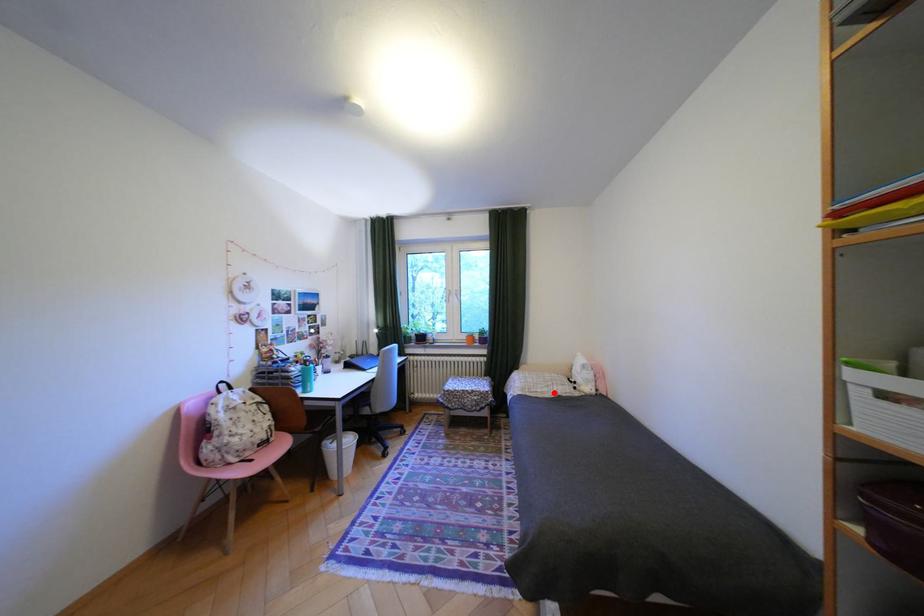
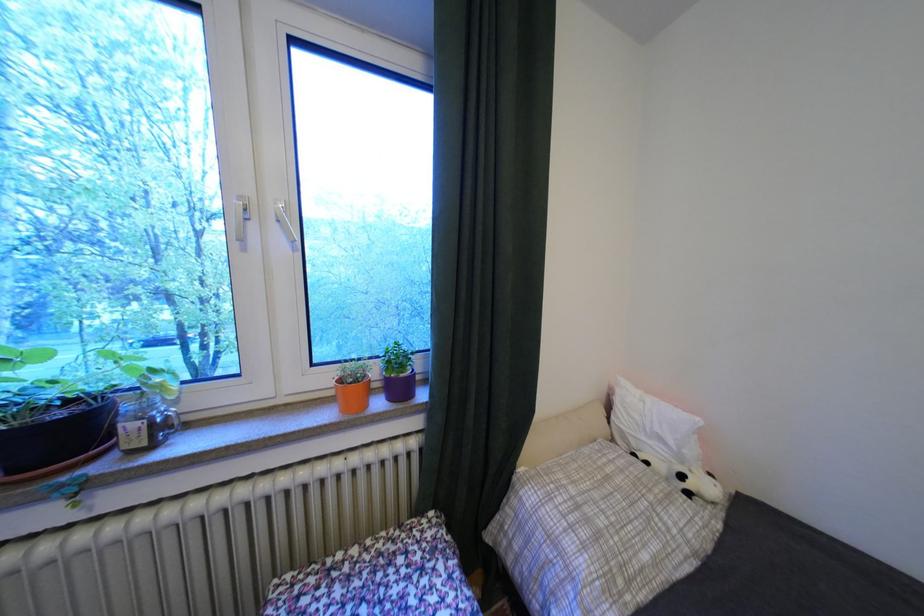
In the second image, find the point that corresponds to the highlighted location in the first image.

(667, 562)